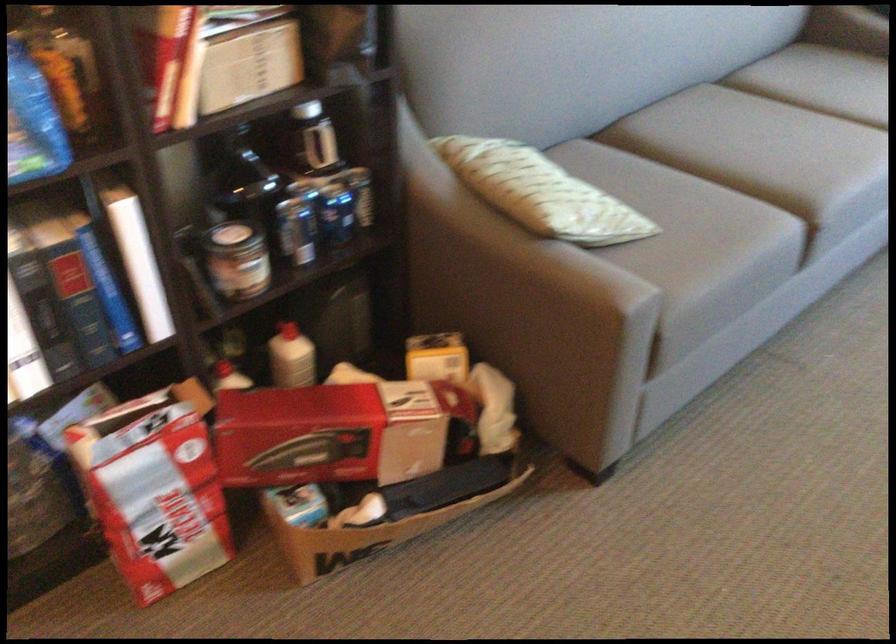
Where would you resting arm the grey sofa armrest? Please return your answer as a coordinate pair (x, y).

(514, 281)